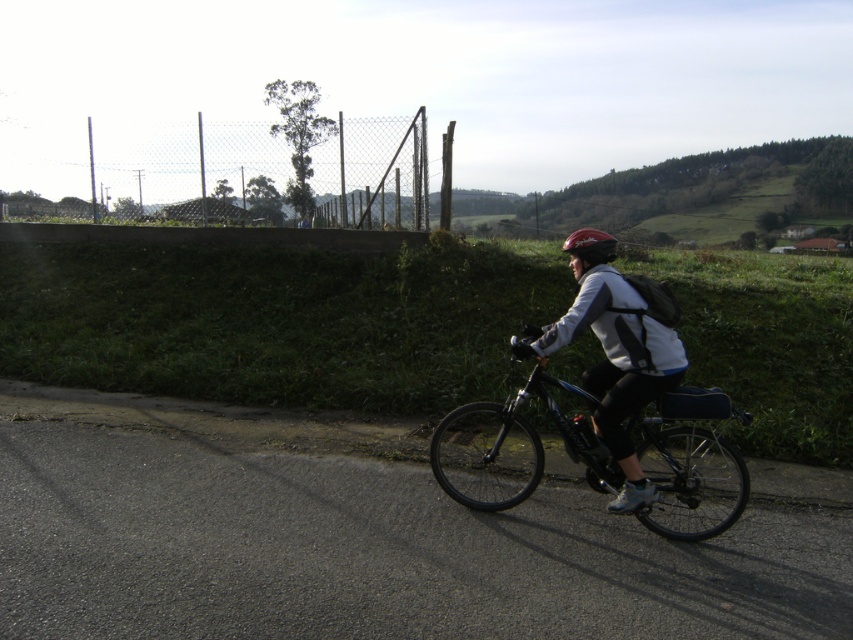
This screenshot has width=853, height=640. Describe the element at coordinates (602, 419) in the screenshot. I see `shiny blue bicycle at center` at that location.

Locate an element on the screen. The width and height of the screenshot is (853, 640). shiny blue bicycle at center is located at coordinates (602, 419).

Can you confirm if shiny blue bicycle at center is positioned above shiny red helmet at center?

Actually, shiny blue bicycle at center is below shiny red helmet at center.

Is shiny blue bicycle at center shorter than shiny red helmet at center?

Incorrect, shiny blue bicycle at center's height does not fall short of shiny red helmet at center's.

Identify the location of shiny blue bicycle at center. (602, 419).

Find the location of a particular element. This screenshot has width=853, height=640. shiny blue bicycle at center is located at coordinates (602, 419).

Which of these two, white matte jacket at center or shiny red helmet at center, stands taller?

white matte jacket at center

Is white matte jacket at center above shiny red helmet at center?

No, white matte jacket at center is not above shiny red helmet at center.

Is point (654, 289) closer to viewer compared to point (579, 248)?

Yes, it is in front of point (579, 248).

Where is `white matte jacket at center`? The height and width of the screenshot is (640, 853). white matte jacket at center is located at coordinates (619, 360).